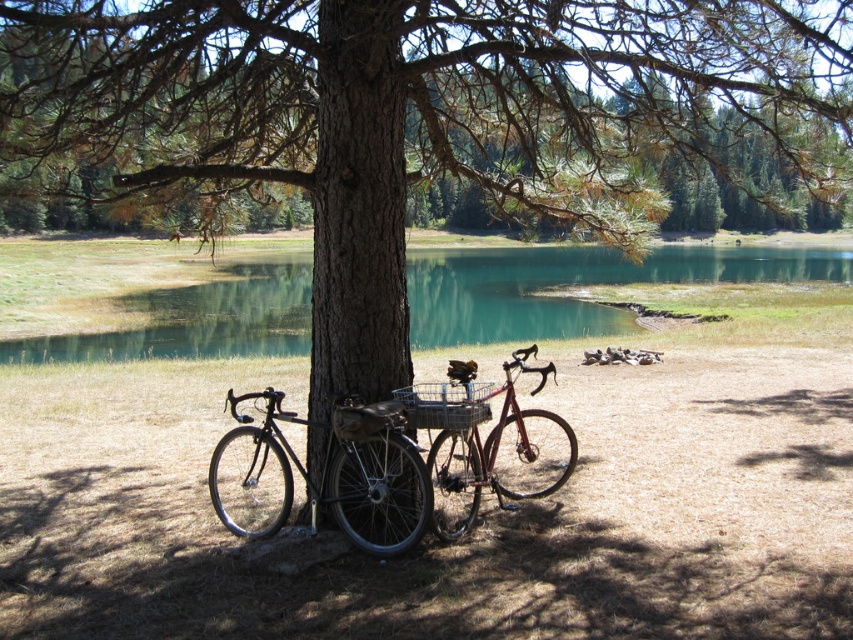
Is green water at center positioned in front of shiny red bicycle at center?

That is False.

Between point (824, 248) and point (527, 486), which one is positioned behind?

The point (824, 248) is behind.

Where is `green water at center`? The width and height of the screenshot is (853, 640). green water at center is located at coordinates (576, 284).

Measure the distance from green water at center to shiny black bicycle at center.

A distance of 77.84 feet exists between green water at center and shiny black bicycle at center.

Can you confirm if green water at center is positioned below shiny black bicycle at center?

No.

Locate an element on the screen. green water at center is located at coordinates tap(576, 284).

How much distance is there between shiny black bicycle at center and shiny red bicycle at center?

shiny black bicycle at center and shiny red bicycle at center are 1.16 meters apart from each other.

Between shiny black bicycle at center and shiny red bicycle at center, which one is positioned lower?

shiny black bicycle at center

Describe the element at coordinates (328, 470) in the screenshot. The height and width of the screenshot is (640, 853). I see `shiny black bicycle at center` at that location.

I want to click on shiny black bicycle at center, so click(x=328, y=470).